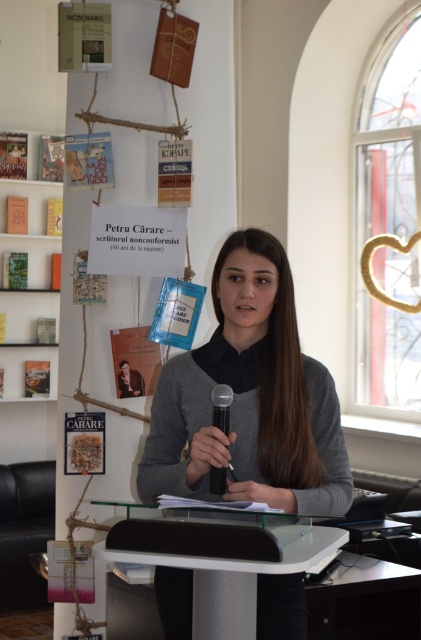
You are organizing an event and need to place a 1.2 meter wide banner on the table. Can the gray matte sweater at center and the white glossy table at center accommodate it?

The gray matte sweater at center is narrower than the white glossy table at center, so the banner may fit on the table if the table is wide enough. However, the sweater itself is not a surface for placing items. Please check the table dimensions separately.

Where is the white glossy table at center located in the image?

The white glossy table at center is located at point (226, 568) in the image.

You are a photographer standing in front of the scene. You want to take a photo that includes both the white glossy table at center and the black plastic microphone at center. Which object will appear larger in the photo?

The white glossy table at center will appear larger in the photo because it is closer to the viewer than the black plastic microphone at center.